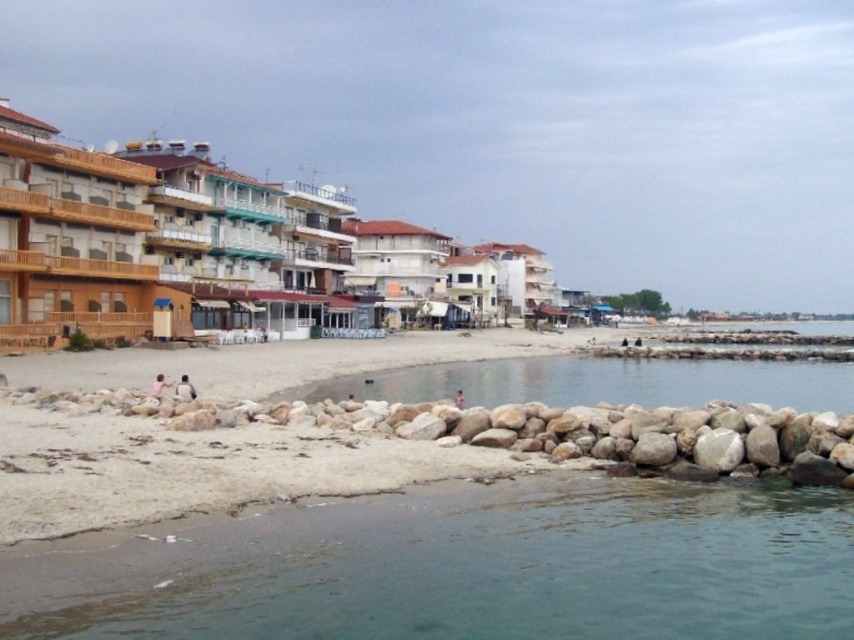
You are a photographer planning to capture the wooden balconies at left and the light brown sand at center in a single shot. Based on their widths, which object would require you to adjust your camera angle to include its full view?

The wooden balconies at left might be wider than light brown sand at center, so you would need to adjust your camera angle to include the full width of the wooden balconies at left.

You are standing at the beach and want to walk towards the point labeled as point (765, 556). However, there is an obstacle at point (155, 388). Can you safely walk around the obstacle to reach your destination?

Since point (765, 556) is in front of point (155, 388), you can safely walk around the obstacle by moving to the side of point (155, 388) and continue towards your destination.